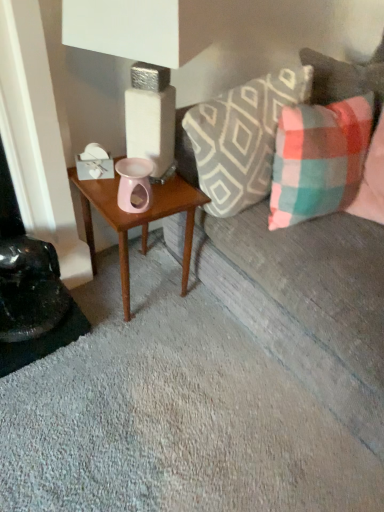
Question: Considering the relative sizes of plaid fabric couch at upper right and plaid fabric pillow at right, the 1th pillow viewed from the right, in the image provided, is plaid fabric couch at upper right wider than plaid fabric pillow at right, the 1th pillow viewed from the right,?

Choices:
 (A) yes
 (B) no

Answer: (A)

Question: Is plaid fabric couch at upper right positioned before plaid fabric pillow at right, the 1th pillow viewed from the right?

Choices:
 (A) yes
 (B) no

Answer: (A)

Question: From the image's perspective, is plaid fabric couch at upper right on top of plaid fabric pillow at right, which is the second pillow from left to right?

Choices:
 (A) yes
 (B) no

Answer: (B)

Question: Does plaid fabric couch at upper right have a greater height compared to plaid fabric pillow at right, the 1th pillow viewed from the right?

Choices:
 (A) no
 (B) yes

Answer: (B)

Question: Is plaid fabric couch at upper right at the left side of plaid fabric pillow at right, the 1th pillow viewed from the right?

Choices:
 (A) no
 (B) yes

Answer: (A)

Question: From a real-world perspective, is plaid fabric couch at upper right physically located above or below plaid fabric pillow at right, which is the second pillow from left to right?

Choices:
 (A) below
 (B) above

Answer: (A)

Question: Does point (380, 350) appear closer or farther from the camera than point (350, 137)?

Choices:
 (A) farther
 (B) closer

Answer: (B)

Question: In terms of height, does plaid fabric couch at upper right look taller or shorter compared to plaid fabric pillow at right, the 1th pillow viewed from the right?

Choices:
 (A) short
 (B) tall

Answer: (B)

Question: From the image's perspective, is plaid fabric couch at upper right located above or below plaid fabric pillow at right, which is the second pillow from left to right?

Choices:
 (A) above
 (B) below

Answer: (B)

Question: From a real-world perspective, is plaid fabric pillow at right, which is the second pillow from left to right, positioned above or below plaid fabric pillow at upper right, which is the 1th pillow in left-to-right order?

Choices:
 (A) above
 (B) below

Answer: (B)

Question: Does point (274, 165) appear closer or farther from the camera than point (203, 126)?

Choices:
 (A) closer
 (B) farther

Answer: (B)

Question: In terms of width, does plaid fabric pillow at right, the 1th pillow viewed from the right, look wider or thinner when compared to plaid fabric pillow at upper right, which is the 1th pillow in left-to-right order?

Choices:
 (A) thin
 (B) wide

Answer: (A)

Question: Is plaid fabric pillow at right, which is the second pillow from left to right, to the left or to the right of plaid fabric pillow at upper right, which is the 1th pillow in left-to-right order, in the image?

Choices:
 (A) left
 (B) right

Answer: (B)

Question: Is plaid fabric pillow at upper right, arranged as the 2th pillow when viewed from the right, wider or thinner than plaid fabric couch at upper right?

Choices:
 (A) thin
 (B) wide

Answer: (A)

Question: Is plaid fabric pillow at upper right, arranged as the 2th pillow when viewed from the right, bigger or smaller than plaid fabric couch at upper right?

Choices:
 (A) big
 (B) small

Answer: (B)